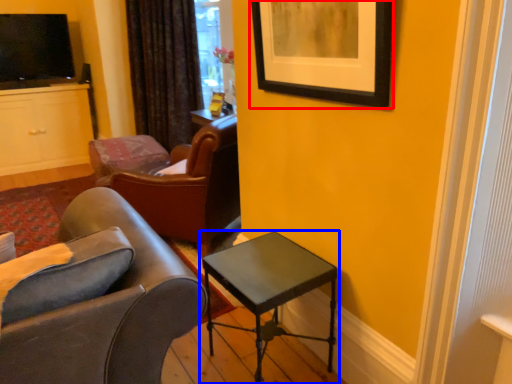
Question: Which object is further to the camera taking this photo, picture frame (highlighted by a red box) or table (highlighted by a blue box)?

Choices:
 (A) picture frame
 (B) table

Answer: (B)